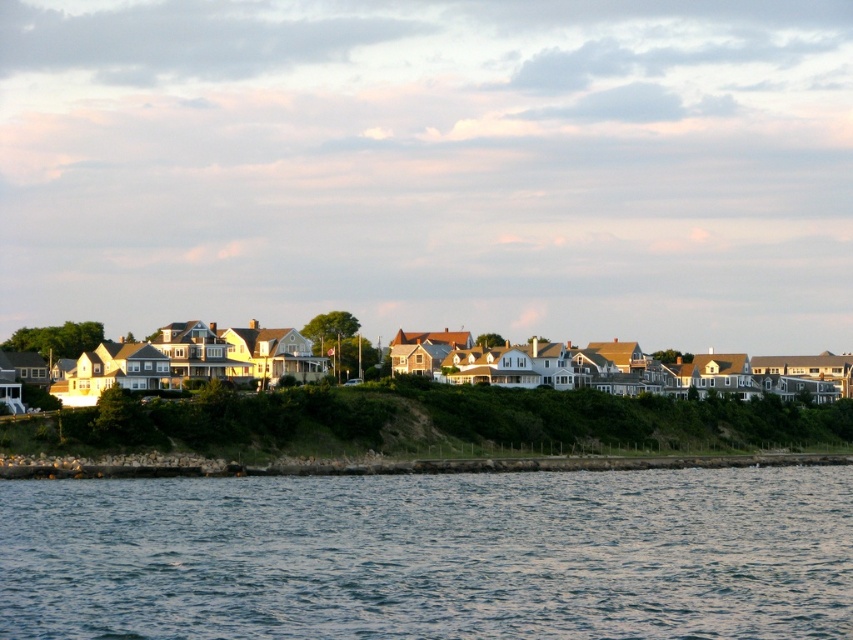
Question: Is blue water at lower center smaller than green grassy hillside at lower center?

Choices:
 (A) yes
 (B) no

Answer: (A)

Question: Which point is farther to the camera?

Choices:
 (A) 320,400
 (B) 646,612

Answer: (A)

Question: Observing the image, what is the correct spatial positioning of blue water at lower center in reference to green grassy hillside at lower center?

Choices:
 (A) below
 (B) above

Answer: (A)

Question: Considering the relative positions of blue water at lower center and green grassy hillside at lower center in the image provided, where is blue water at lower center located with respect to green grassy hillside at lower center?

Choices:
 (A) right
 (B) left

Answer: (B)